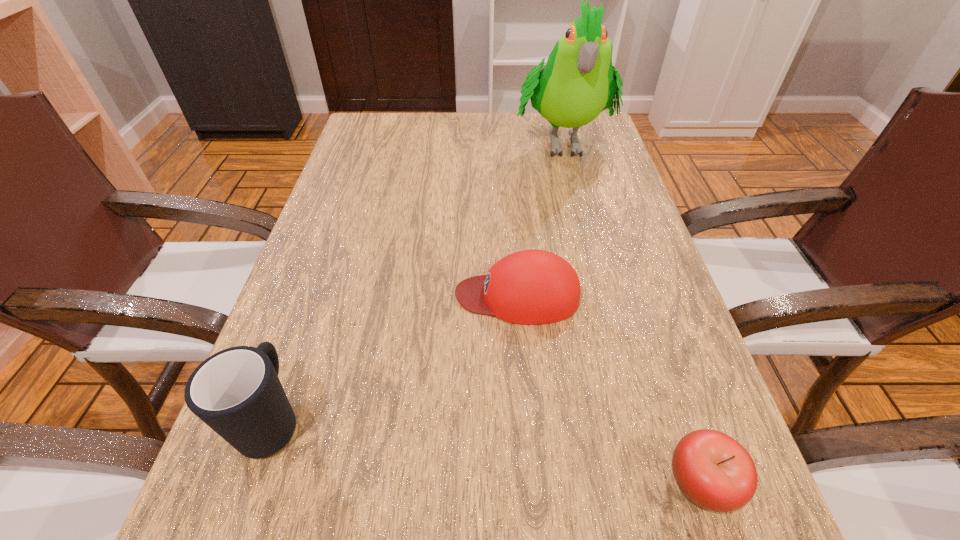
Locate an element on the screen. This screenshot has height=540, width=960. blank area located on the front-facing side of the third nearest object is located at coordinates (382, 295).

Image resolution: width=960 pixels, height=540 pixels. What are the coordinates of `free location located 0.120m on the front-facing side of the third nearest object` in the screenshot? It's located at (393, 295).

The image size is (960, 540). Find the location of `vacant region located 0.320m on the front-facing side of the third nearest object`. vacant region located 0.320m on the front-facing side of the third nearest object is located at coordinates (288, 295).

The width and height of the screenshot is (960, 540). I want to click on free space located 0.140m on the back of the apple, so click(x=661, y=364).

In order to click on object that is at the far edge in this screenshot , I will do `click(578, 82)`.

Identify the location of object at the left edge. The image size is (960, 540). (236, 392).

This screenshot has height=540, width=960. In order to click on parakeet that is at the right edge in this screenshot , I will do `click(578, 82)`.

Locate an element on the screen. The height and width of the screenshot is (540, 960). apple positioned at the right edge is located at coordinates (715, 472).

Where is `object located in the far right corner section of the desktop`? Image resolution: width=960 pixels, height=540 pixels. object located in the far right corner section of the desktop is located at coordinates (578, 82).

Find the location of a particular element. vacant area at the far edge of the desktop is located at coordinates (439, 124).